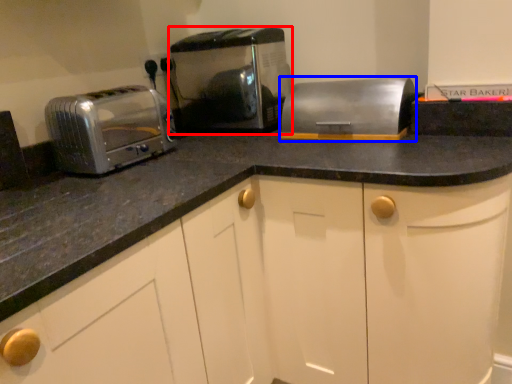
Question: Which point is closer to the camera, toaster (highlighted by a red box) or appliance (highlighted by a blue box)?

Choices:
 (A) toaster
 (B) appliance

Answer: (B)